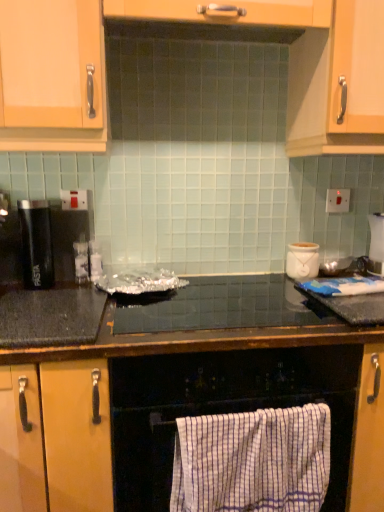
Question: Is white striped towel at lower center smaller than white checkered towel at lower center?

Choices:
 (A) no
 (B) yes

Answer: (B)

Question: From a real-world perspective, is white striped towel at lower center positioned over white checkered towel at lower center based on gravity?

Choices:
 (A) yes
 (B) no

Answer: (A)

Question: Is white striped towel at lower center positioned with its back to white checkered towel at lower center?

Choices:
 (A) yes
 (B) no

Answer: (A)

Question: Is white striped towel at lower center in contact with white checkered towel at lower center?

Choices:
 (A) yes
 (B) no

Answer: (A)

Question: From the image's perspective, is white striped towel at lower center below white checkered towel at lower center?

Choices:
 (A) yes
 (B) no

Answer: (A)

Question: Is white checkered towel at lower center surrounded by white striped towel at lower center?

Choices:
 (A) yes
 (B) no

Answer: (B)

Question: Is white checkered towel at lower center positioned in front of black matte pasta container at left?

Choices:
 (A) no
 (B) yes

Answer: (B)

Question: Does white checkered towel at lower center have a lesser height compared to black matte pasta container at left?

Choices:
 (A) yes
 (B) no

Answer: (B)

Question: Is white checkered towel at lower center looking in the opposite direction of black matte pasta container at left?

Choices:
 (A) no
 (B) yes

Answer: (A)

Question: Can you confirm if white checkered towel at lower center is wider than black matte pasta container at left?

Choices:
 (A) no
 (B) yes

Answer: (B)

Question: Is white checkered towel at lower center placed right next to black matte pasta container at left?

Choices:
 (A) no
 (B) yes

Answer: (A)

Question: From the image's perspective, is white checkered towel at lower center above black matte pasta container at left?

Choices:
 (A) no
 (B) yes

Answer: (A)

Question: Are black granite countertop at center, positioned as the 2th countertop in top-to-bottom order, and black matte pasta container at left making contact?

Choices:
 (A) yes
 (B) no

Answer: (B)